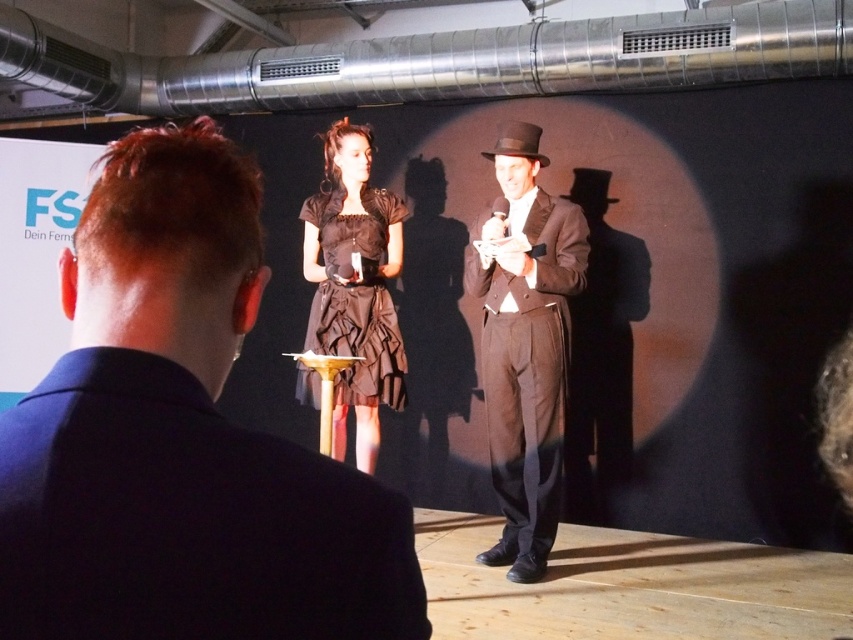
Question: Observing the image, what is the correct spatial positioning of shiny brown suit at center in reference to black felt dress hat at center?

Choices:
 (A) above
 (B) below

Answer: (B)

Question: Does matte black suit at center appear over white matte projection screen at upper left?

Choices:
 (A) no
 (B) yes

Answer: (A)

Question: Which point is closer to the camera taking this photo?

Choices:
 (A) (77, 531)
 (B) (531, 156)
 (C) (386, 244)

Answer: (A)

Question: Based on their relative distances, which object is nearer to the matte black suit at center?

Choices:
 (A) black satin dress at center
 (B) black felt dress hat at center
 (C) white matte projection screen at upper left
 (D) black matte projection screen at upper center

Answer: (A)

Question: Which is farther from the matte black suit at center?

Choices:
 (A) black satin dress at center
 (B) black felt dress hat at center

Answer: (B)

Question: Can you confirm if black matte projection screen at upper center is positioned above shiny brown suit at center?

Choices:
 (A) no
 (B) yes

Answer: (B)